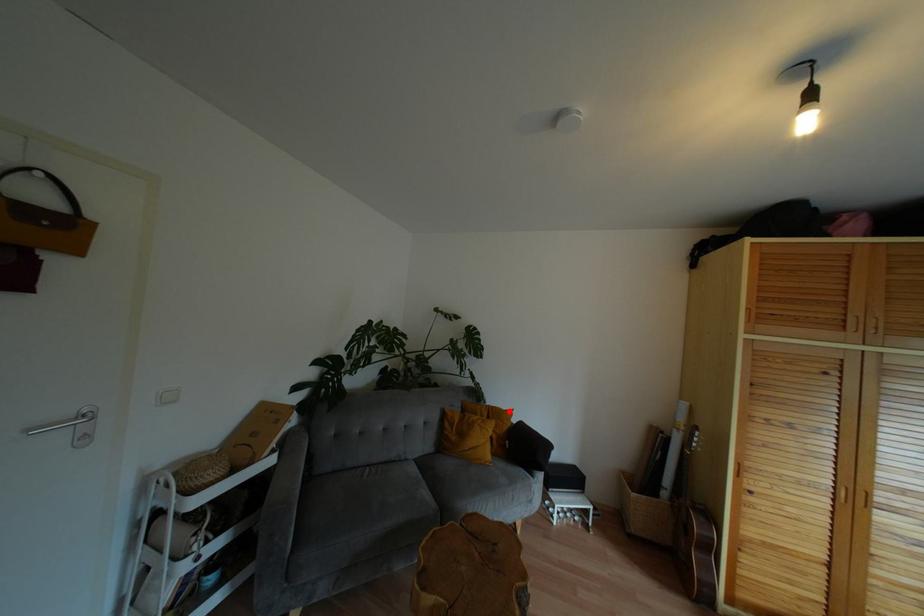
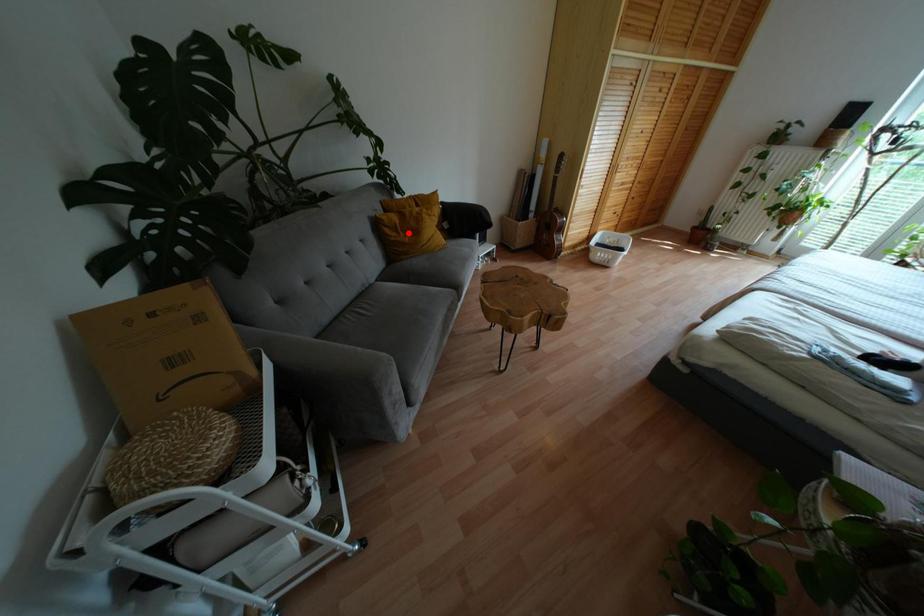
Looking at this image, I am providing you with two images of the same scene from different viewpoints. A red point is marked on the first image and another point is marked on the second image. Is the marked point in image1 the same physical position as the marked point in image2?

No